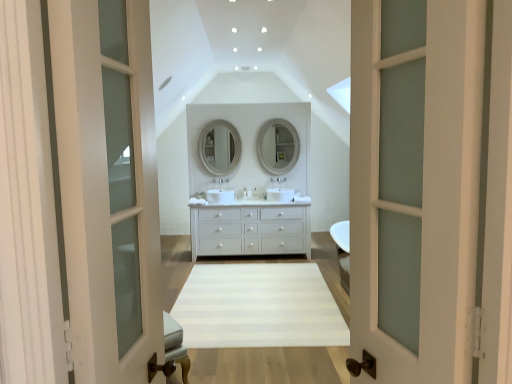
Where is `free space in front of white matte chest of drawers at center`? Image resolution: width=512 pixels, height=384 pixels. free space in front of white matte chest of drawers at center is located at coordinates (259, 274).